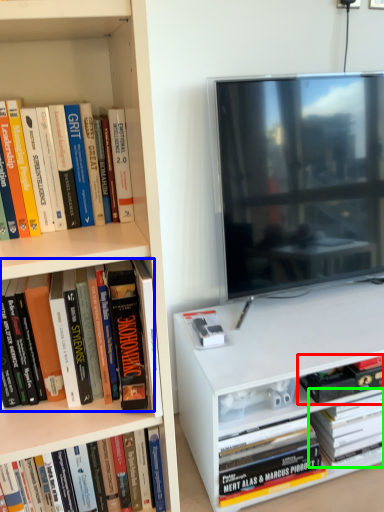
Question: Considering the real-world distances, which object is closest to book (highlighted by a red box)? book (highlighted by a blue box) or book (highlighted by a green box).

Choices:
 (A) book
 (B) book

Answer: (B)